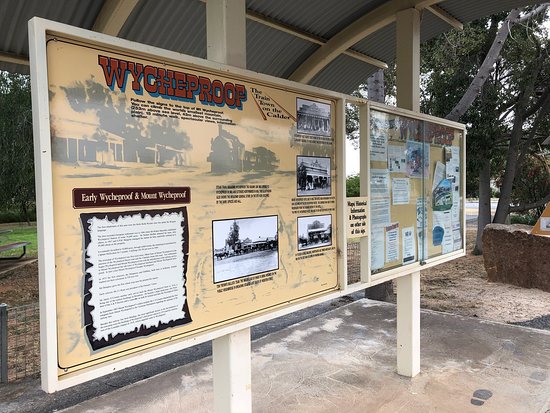
You are a GUI agent. You are given a task and a screenshot of the screen. Output one action in this format:
    pyautogui.click(x=<x>, y=<y>)
    Task: Click on the bulletin board
    The height and width of the screenshot is (413, 550).
    Given the screenshot: What is the action you would take?
    pyautogui.click(x=399, y=218), pyautogui.click(x=436, y=165)